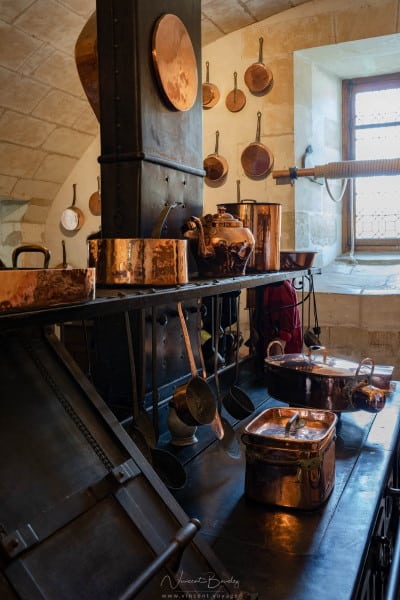
The width and height of the screenshot is (400, 600). Identify the location of stock pot. (267, 222).